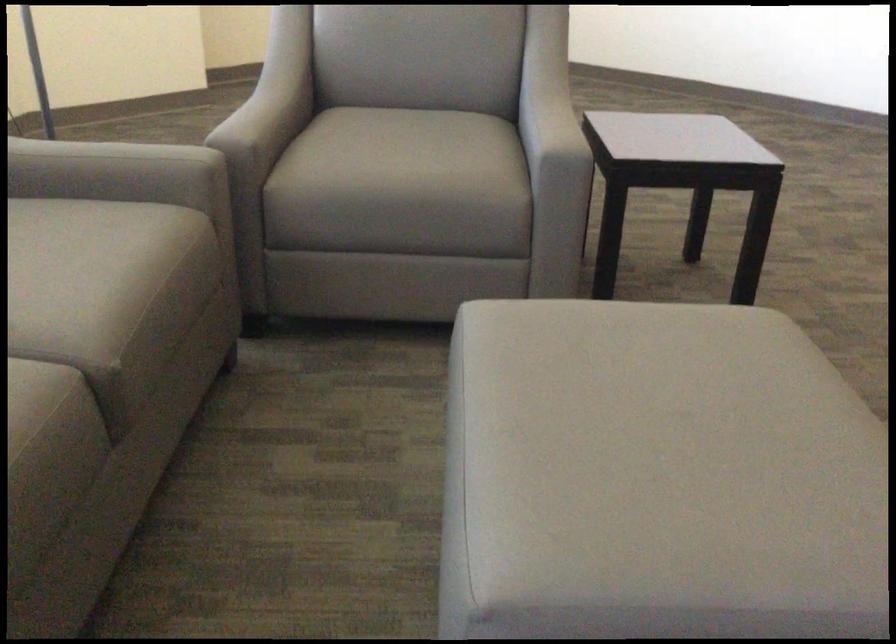
Image resolution: width=896 pixels, height=644 pixels. What do you see at coordinates (115, 172) in the screenshot?
I see `the sofa armrest` at bounding box center [115, 172].